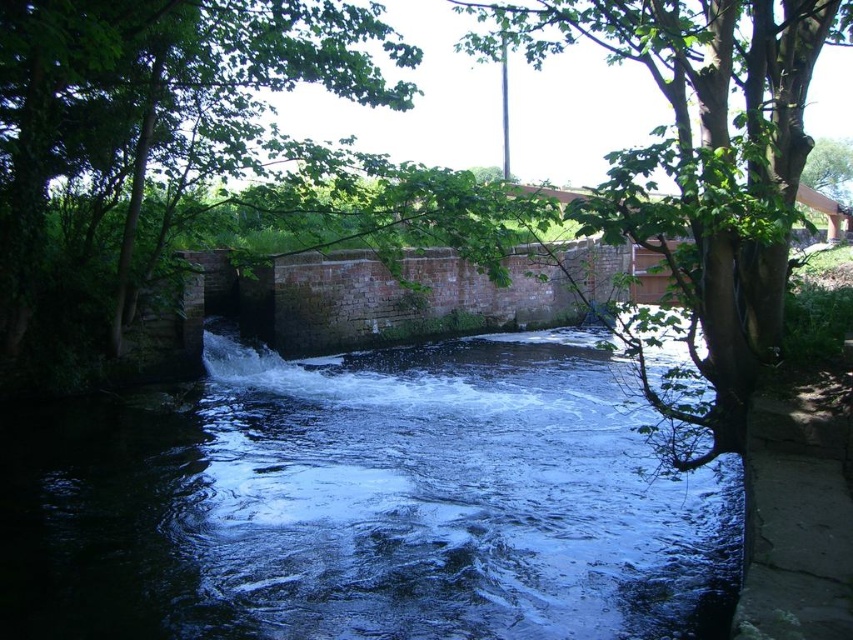
Who is shorter, dark blue water at center or green leafy tree at upper right?

With less height is dark blue water at center.

Which is in front, point (380, 380) or point (706, 397)?

Point (706, 397) is more forward.

At what (x,y) coordinates should I click in order to perform the action: click on dark blue water at center. Please return your answer as a coordinate pair (x, y). Image resolution: width=853 pixels, height=640 pixels. Looking at the image, I should click on (364, 504).

Where is `dark blue water at center`? dark blue water at center is located at coordinates (364, 504).